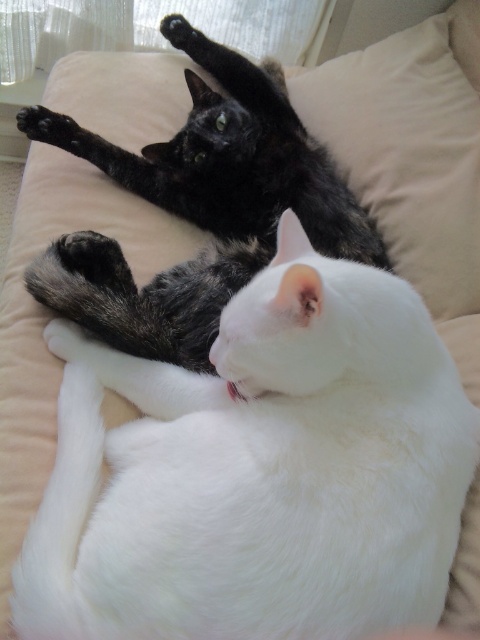
Does white fluffy cat at center appear on the right side of black fur cat at upper center?

Correct, you'll find white fluffy cat at center to the right of black fur cat at upper center.

Between point (169, 410) and point (220, 244), which one is positioned behind?

The point (220, 244) is behind.

Who is more distant from viewer, (422, 516) or (208, 262)?

Point (208, 262)

Locate an element on the screen. The height and width of the screenshot is (640, 480). white fluffy cat at center is located at coordinates (259, 472).